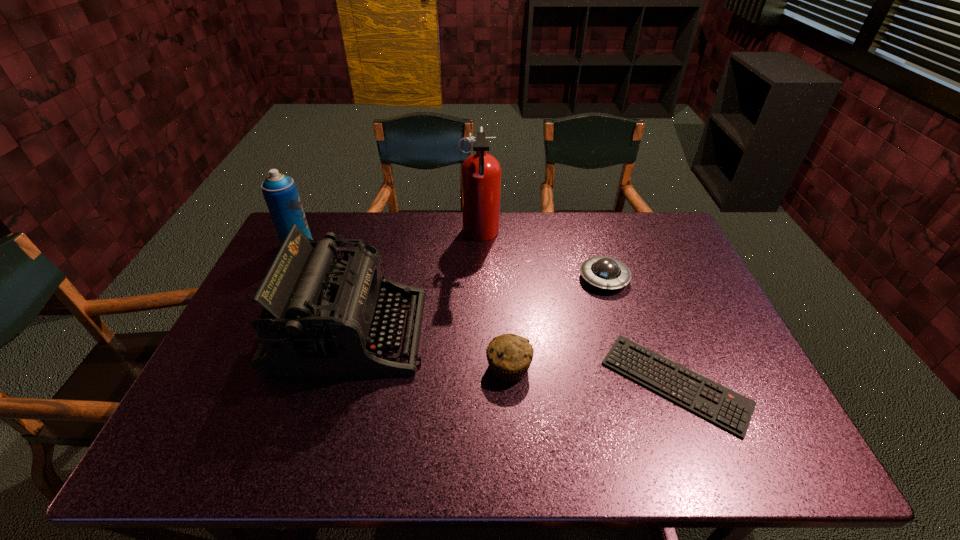
Find the location of `vacant space situated on the front of the second shortest object`. vacant space situated on the front of the second shortest object is located at coordinates (617, 321).

What are the coordinates of `vacant position located on the left of the shortest object` in the screenshot? It's located at (511, 383).

You are a GUI agent. You are given a task and a screenshot of the screen. Output one action in this format:
    pyautogui.click(x=<x>, y=<y>)
    Task: Click on the fire extinguisher situated at the far edge
    This screenshot has height=540, width=960.
    Given the screenshot: What is the action you would take?
    pyautogui.click(x=480, y=173)

The height and width of the screenshot is (540, 960). Find the location of `aerosol can that is at the far edge`. aerosol can that is at the far edge is located at coordinates (280, 192).

Where is `object that is at the near edge`? object that is at the near edge is located at coordinates (731, 411).

Where is `aerosol can at the left edge`? aerosol can at the left edge is located at coordinates (280, 192).

Locate an element on the screen. This screenshot has width=960, height=540. typewriter that is at the left edge is located at coordinates (321, 315).

In order to click on object at the right edge in this screenshot , I will do `click(731, 411)`.

Identify the location of object at the far left corner. The width and height of the screenshot is (960, 540). (280, 192).

Identify the location of object that is at the near right corner. (731, 411).